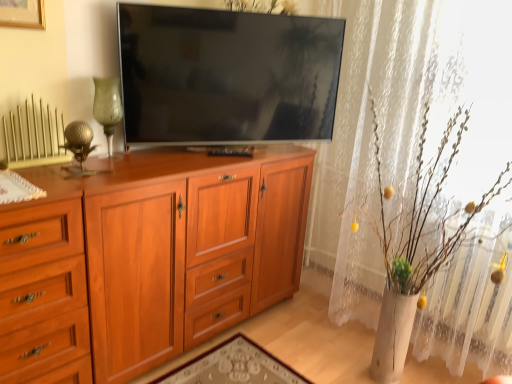
Where is `free space above flat screen tv at center (from a real-world perspective)`? The image size is (512, 384). free space above flat screen tv at center (from a real-world perspective) is located at coordinates (248, 6).